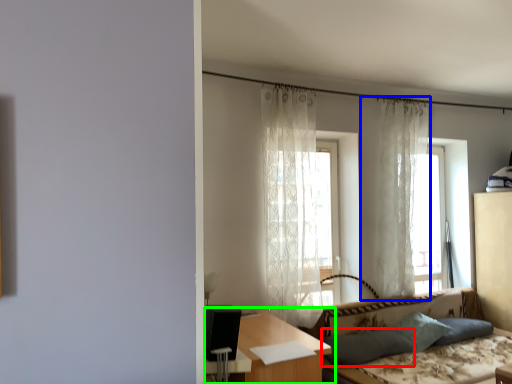
Question: Which is farther away from pillow (highlighted by a red box)? curtain (highlighted by a blue box) or table (highlighted by a green box)?

Choices:
 (A) curtain
 (B) table

Answer: (A)